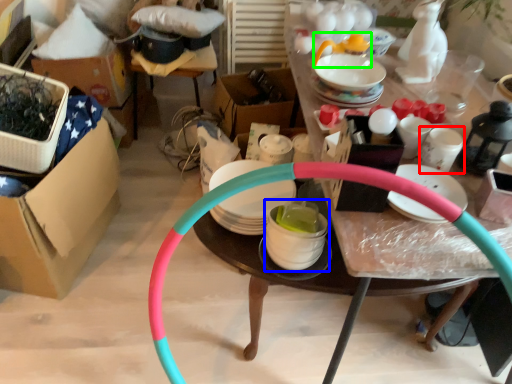
Question: Which object is positioned farthest from tableware (highlighted by a red box)? Select from tableware (highlighted by a blue box) and tableware (highlighted by a green box).

Choices:
 (A) tableware
 (B) tableware

Answer: (B)